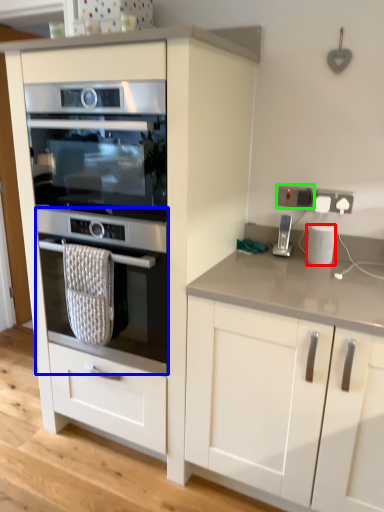
Question: Estimate the real-world distances between objects in this image. Which object is farther from kitchen appliance (highlighted by a red box), oven (highlighted by a blue box) or electric outlet (highlighted by a green box)?

Choices:
 (A) oven
 (B) electric outlet

Answer: (A)